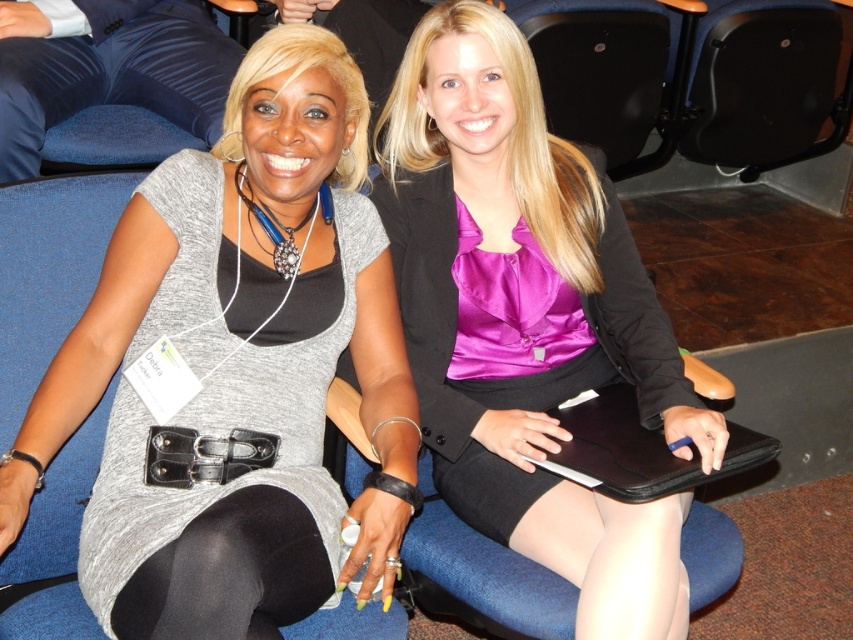
You are an event planner arranging seating for an awards ceremony. You need to ensure that the matte gray dress at center and the purple satin blouse at center are visible to the audience. Based on their positions, which clothing item is more likely to be seen by the audience?

The matte gray dress at center is above the purple satin blouse at center, so the matte gray dress at center is more likely to be seen by the audience as it is positioned higher.

Looking at this image, you are organizing a photoshoot and need to ensure that the matte gray dress at center and the purple satin blouse at center are displayed properly. Based on their sizes, which item should be placed on a larger mannequin to fit appropriately?

The purple satin blouse at center requires a larger mannequin because it is bigger than the matte gray dress at center.

You are an event organizer who needs to arrange seating for a panel discussion. The two attendees are wearing the matte gray dress at center and the purple satin blouse at center. Based on their current seating positions, which attendee should you seat to the right side of the stage to maintain their relative positions?

The purple satin blouse at center should be seated to the right side of the stage because the matte gray dress at center is currently to the left of the purple satin blouse at center, so maintaining their positions would require placing the purple satin blouse at center on the right.